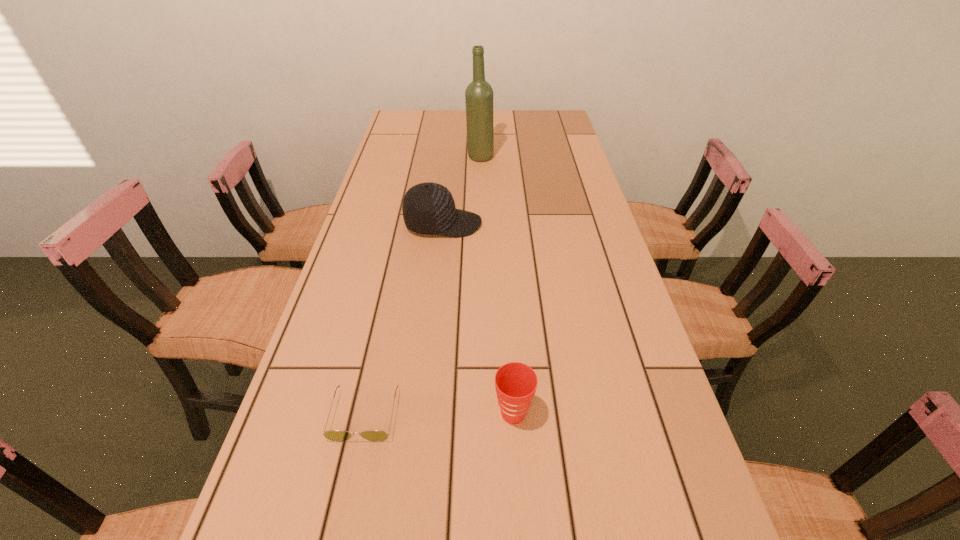
Find the location of a particular element. The image size is (960, 540). wine bottle is located at coordinates (479, 94).

At what (x,y) coordinates should I click in order to perform the action: click on the farthest object. Please return your answer as a coordinate pair (x, y). Looking at the image, I should click on click(x=479, y=94).

You are a GUI agent. You are given a task and a screenshot of the screen. Output one action in this format:
    pyautogui.click(x=<x>, y=<y>)
    Task: Click on the baseball cap
    This screenshot has height=540, width=960.
    Given the screenshot: What is the action you would take?
    pyautogui.click(x=428, y=208)

Where is `the third nearest object`? the third nearest object is located at coordinates (428, 208).

Where is `the second shortest object`? This screenshot has height=540, width=960. the second shortest object is located at coordinates click(x=515, y=383).

Where is `sunglasses`? sunglasses is located at coordinates (333, 435).

Image resolution: width=960 pixels, height=540 pixels. In order to click on free region located on the front of the tallest object in this screenshot , I will do `click(480, 174)`.

Image resolution: width=960 pixels, height=540 pixels. In order to click on vacant space situated at the front of the third shortest object where the brim is located in this screenshot , I will do `click(565, 224)`.

I want to click on free region located on the front of the third tallest object, so click(520, 525).

Find the location of `vacant region located on the front-facing side of the shortest object`. vacant region located on the front-facing side of the shortest object is located at coordinates (348, 494).